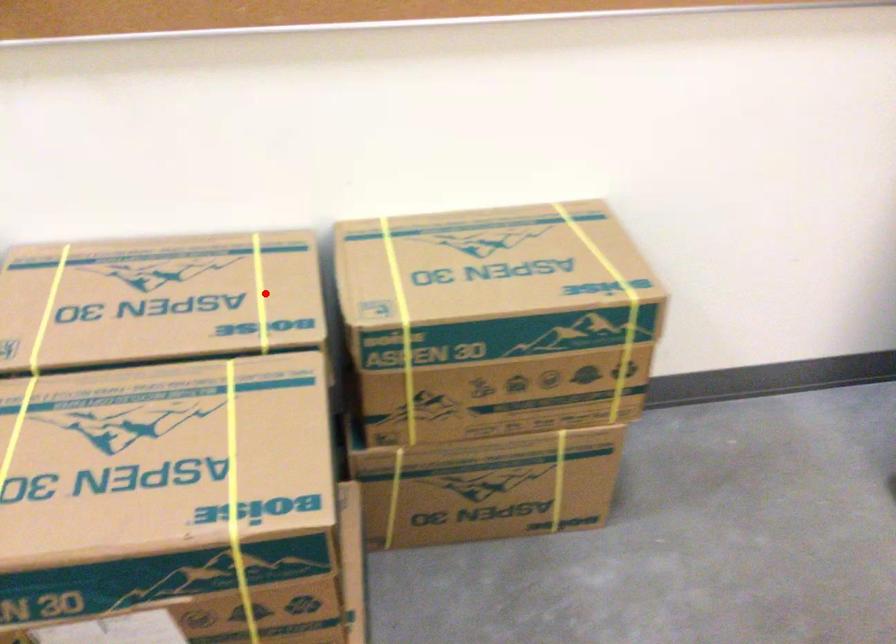
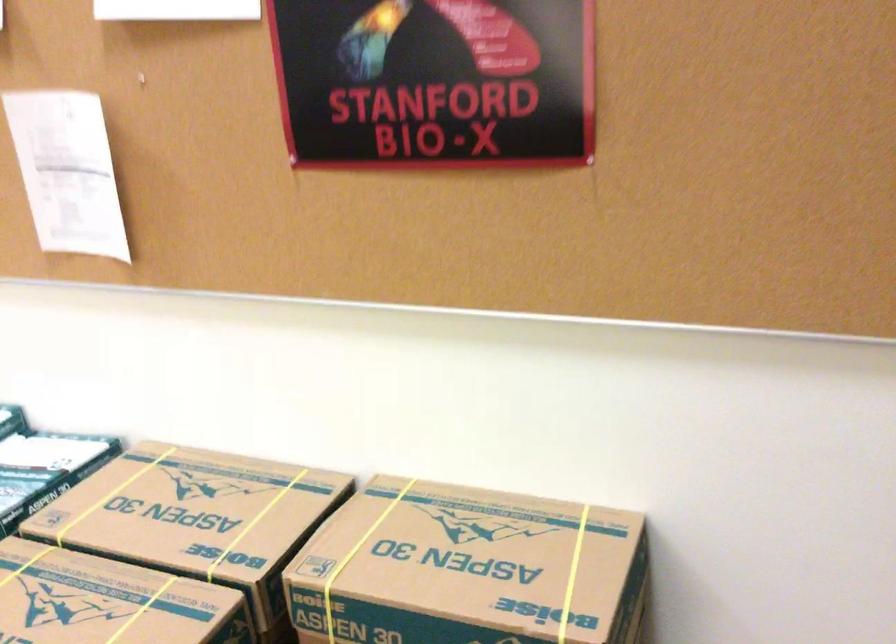
Where in the second image is the point corresponding to the highlighted location from the first image?

(254, 523)